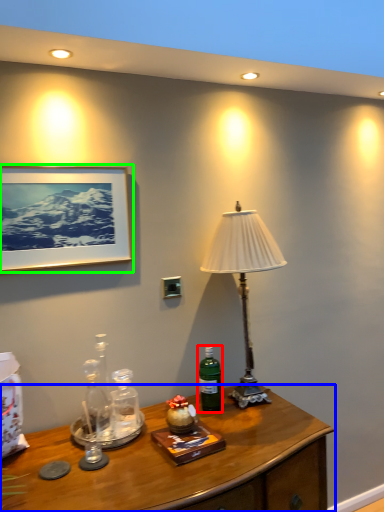
Question: Estimate the real-world distances between objects in this image. Which object is closer to bottle (highlighted by a red box), desk (highlighted by a blue box) or picture frame (highlighted by a green box)?

Choices:
 (A) desk
 (B) picture frame

Answer: (A)